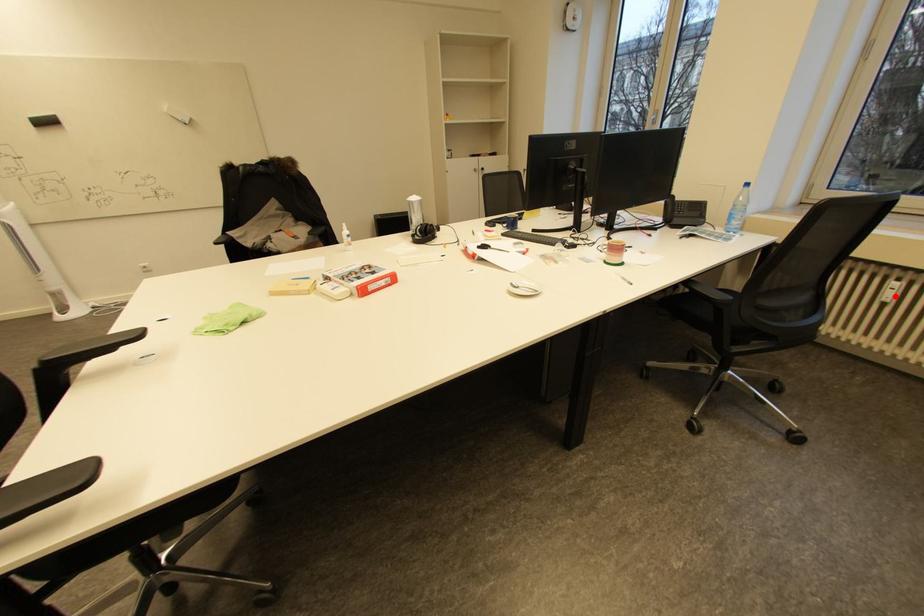
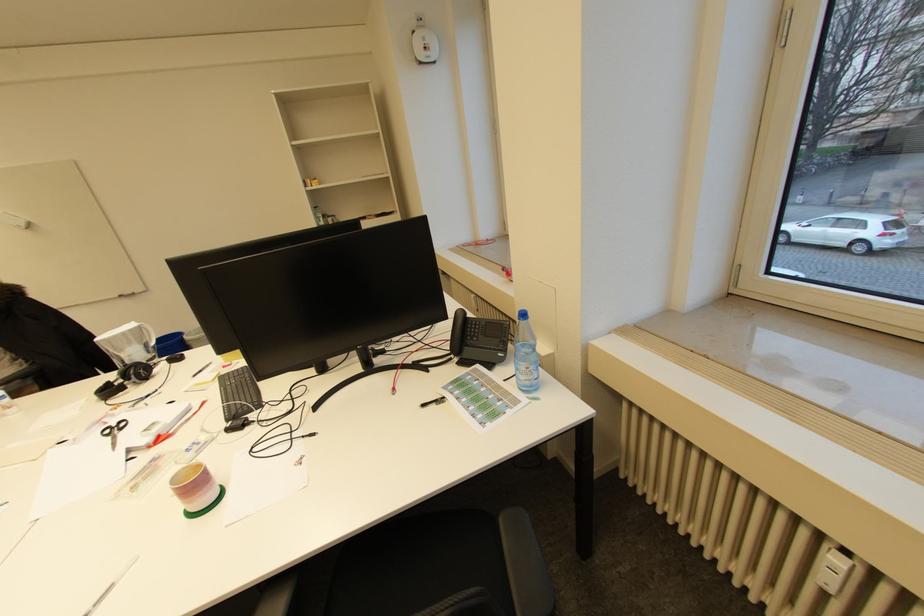
The point at the highlighted location is marked in the first image. Where is the corresponding point in the second image?

(833, 580)